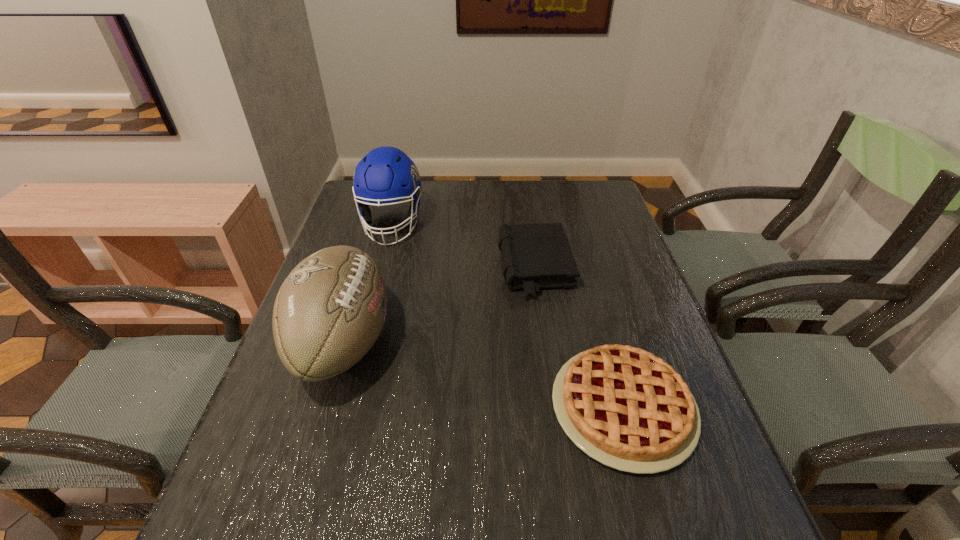
Locate an element on the screen. vacant area that lies between the shortest object and the football helmet is located at coordinates (508, 315).

Find the location of a particular element. Image resolution: width=960 pixels, height=540 pixels. vacant space that's between the football (American) and the pie is located at coordinates (483, 375).

Image resolution: width=960 pixels, height=540 pixels. I want to click on vacant point located between the football (American) and the Bible, so click(439, 305).

Locate which object ranks in proximity to the football helmet. Please provide its 2D coordinates. Your answer should be formatted as a tuple, i.e. [(x, y)], where the tuple contains the x and y coordinates of a point satisfying the conditions above.

[(330, 310)]

The image size is (960, 540). I want to click on object that is the third closest to the football (American), so click(628, 409).

At what (x,y) coordinates should I click in order to perform the action: click on vacant space that satisfies the following two spatial constraints: 1. on the laces of the pie; 2. on the right side of the football (American). Please return your answer as a coordinate pair (x, y). This screenshot has height=540, width=960. Looking at the image, I should click on (324, 407).

Where is `free space that satisfies the following two spatial constraints: 1. on the front-facing side of the football helmet; 2. on the left side of the shortest object`? This screenshot has height=540, width=960. free space that satisfies the following two spatial constraints: 1. on the front-facing side of the football helmet; 2. on the left side of the shortest object is located at coordinates (x=344, y=407).

The height and width of the screenshot is (540, 960). In order to click on free space that satisfies the following two spatial constraints: 1. on the front-facing side of the pie; 2. on the right side of the football helmet in this screenshot , I will do `click(344, 407)`.

Where is `vacant point that satisfies the following two spatial constraints: 1. on the front side of the Bible; 2. on the laces of the football (American)`? Image resolution: width=960 pixels, height=540 pixels. vacant point that satisfies the following two spatial constraints: 1. on the front side of the Bible; 2. on the laces of the football (American) is located at coordinates (545, 342).

Locate an element on the screen. vacant space that satisfies the following two spatial constraints: 1. on the front side of the Bible; 2. on the right side of the pie is located at coordinates (555, 407).